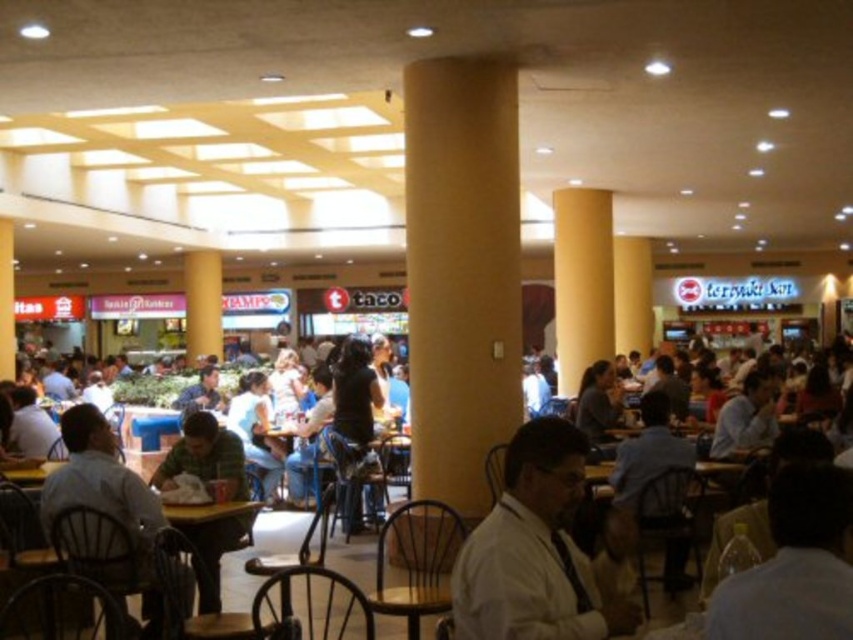
Does yellow matte column at center appear under white shirt at center?

Incorrect, yellow matte column at center is not positioned below white shirt at center.

Who is positioned more to the right, yellow matte column at center or white shirt at center?

white shirt at center

You are a GUI agent. You are given a task and a screenshot of the screen. Output one action in this format:
    pyautogui.click(x=<x>, y=<y>)
    Task: Click on the yellow matte column at center
    The height and width of the screenshot is (640, 853).
    Given the screenshot: What is the action you would take?
    pyautogui.click(x=461, y=272)

I want to click on yellow matte column at center, so click(x=461, y=272).

Is yellow matte column at center taller than light brown wooden chair at lower left?

Yes, yellow matte column at center is taller than light brown wooden chair at lower left.

Does yellow matte column at center lie in front of light brown wooden chair at lower left?

No.

Is point (468, 464) positioned in front of point (61, 508)?

That is False.

Locate an element on the screen. The image size is (853, 640). yellow matte column at center is located at coordinates (461, 272).

Between white fabric shirt at lower right and light brown wooden chair at lower left, which one is positioned lower?

light brown wooden chair at lower left is below.

Is the position of white fabric shirt at lower right less distant than that of light brown wooden chair at lower left?

Yes, white fabric shirt at lower right is closer to the viewer.

What do you see at coordinates (795, 564) in the screenshot?
I see `white fabric shirt at lower right` at bounding box center [795, 564].

You are a GUI agent. You are given a task and a screenshot of the screen. Output one action in this format:
    pyautogui.click(x=<x>, y=<y>)
    Task: Click on the white fabric shirt at lower right
    The width and height of the screenshot is (853, 640).
    Given the screenshot: What is the action you would take?
    pyautogui.click(x=795, y=564)